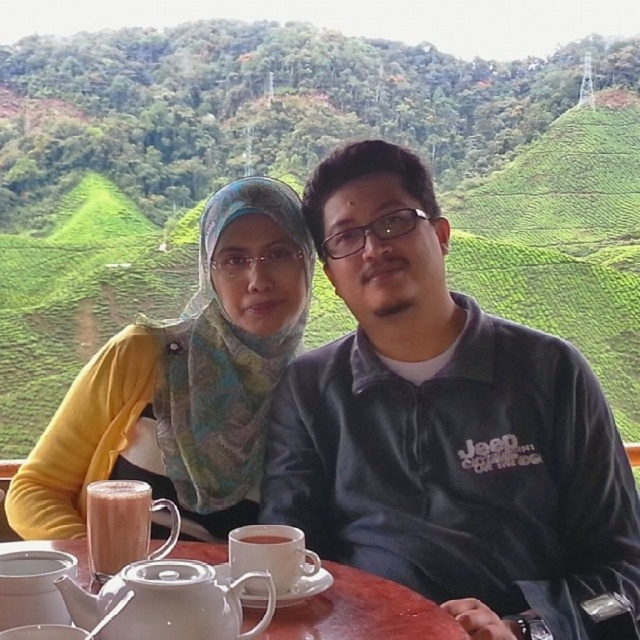
Who is positioned more to the right, green grassy hillside at upper center or brown matte cup at center?

From the viewer's perspective, brown matte cup at center appears more on the right side.

Does green grassy hillside at upper center appear over brown matte cup at center?

Indeed, green grassy hillside at upper center is positioned over brown matte cup at center.

Does point (252, 131) come farther from viewer compared to point (282, 541)?

Yes, point (252, 131) is farther from viewer.

Where is `green grassy hillside at upper center`? The height and width of the screenshot is (640, 640). green grassy hillside at upper center is located at coordinates (304, 177).

Is green grassy hillside at upper center shorter than white ceramic saucer at center?

No, green grassy hillside at upper center is not shorter than white ceramic saucer at center.

Can you confirm if green grassy hillside at upper center is wider than white ceramic saucer at center?

Indeed, green grassy hillside at upper center has a greater width compared to white ceramic saucer at center.

Does point (268, 157) come closer to viewer compared to point (323, 568)?

No, it is behind (323, 568).

This screenshot has height=640, width=640. I want to click on green grassy hillside at upper center, so click(304, 177).

Can you confirm if white glossy teapot at lower center is positioned above white ceramic cup at center?

Correct, white glossy teapot at lower center is located above white ceramic cup at center.

Does white glossy teapot at lower center lie behind white ceramic cup at center?

No.

Does point (161, 561) come farther from viewer compared to point (273, 538)?

No, it is not.

The image size is (640, 640). Identify the location of white glossy teapot at lower center. (164, 602).